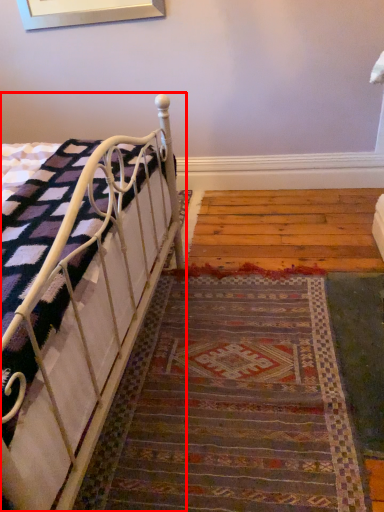
Question: From the image's perspective, what is the correct spatial positioning of bed (annotated by the red box) in reference to doormat?

Choices:
 (A) below
 (B) above

Answer: (B)